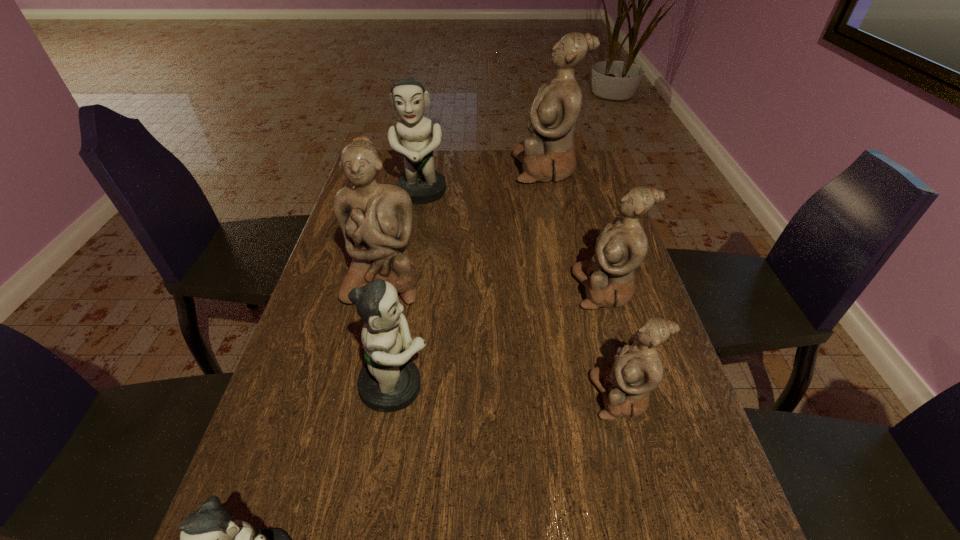
This screenshot has height=540, width=960. Find the location of `object that is at the far right corner`. object that is at the far right corner is located at coordinates (548, 154).

The image size is (960, 540). I want to click on vacant space at the far edge of the desktop, so click(498, 151).

Where is `free location at the left edge`? This screenshot has width=960, height=540. free location at the left edge is located at coordinates (260, 530).

Identify the location of vacant space at the right edge. This screenshot has width=960, height=540. (646, 428).

At what (x,y) coordinates should I click in order to perform the action: click on vacant space at the far right corner of the desktop. Please return your answer as a coordinate pair (x, y). The image size is (960, 540). Looking at the image, I should click on (584, 166).

In order to click on vacant space that is in between the nearest white figurine and the third smallest white figurine in this screenshot , I will do click(502, 339).

This screenshot has height=540, width=960. I want to click on free area in between the smallest white figurine and the biggest green figurine, so click(521, 295).

Choose which object is the fourth nearest neighbor to the second smallest green figurine. Please provide its 2D coordinates. Your answer should be formatted as a tuple, i.e. [(x, y)], where the tuple contains the x and y coordinates of a point satisfying the conditions above.

[(621, 247)]

At what (x,y) coordinates should I click in order to perform the action: click on object that is the second closest to the third biggest white figurine. Please return your answer as a coordinate pair (x, y). Image resolution: width=960 pixels, height=540 pixels. Looking at the image, I should click on (389, 381).

Locate an element on the screen. the fifth closest figurine to the leftmost white figurine is located at coordinates (548, 154).